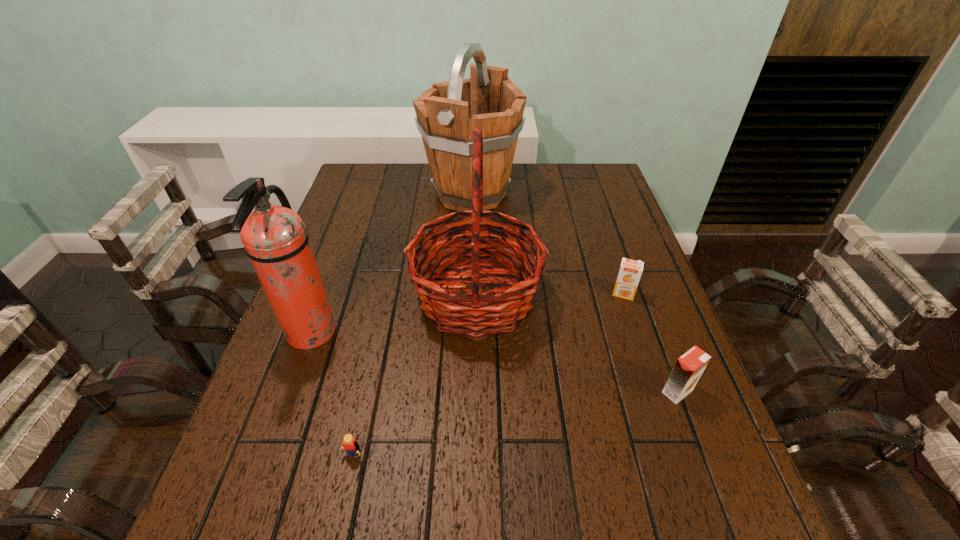
The height and width of the screenshot is (540, 960). I want to click on free point that satisfies the following two spatial constraints: 1. on the front side of the basket; 2. at the nozzle of the leftmost object, so click(476, 333).

I want to click on vacant point that satisfies the following two spatial constraints: 1. on the back side of the fifth farthest object; 2. at the nozzle of the leftmost object, so click(656, 333).